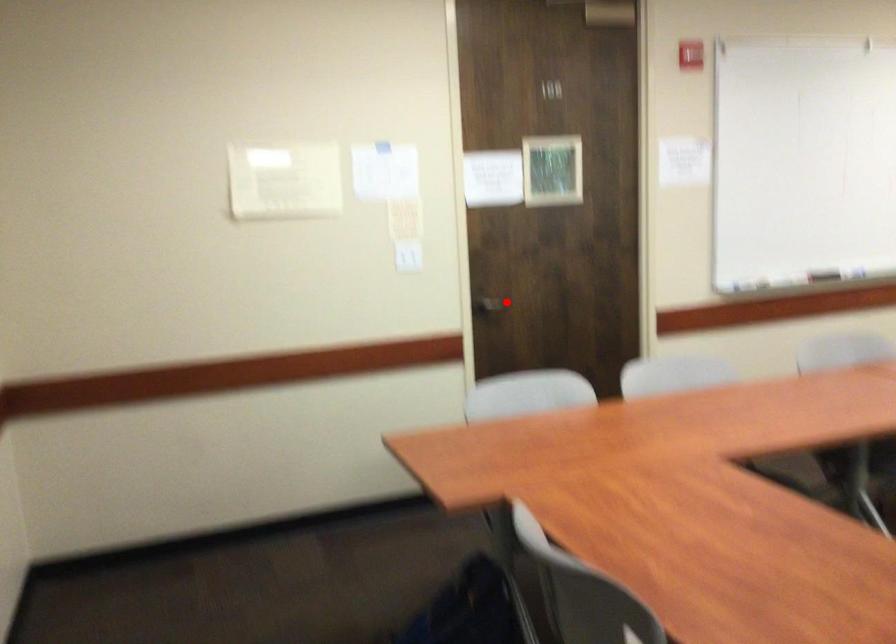
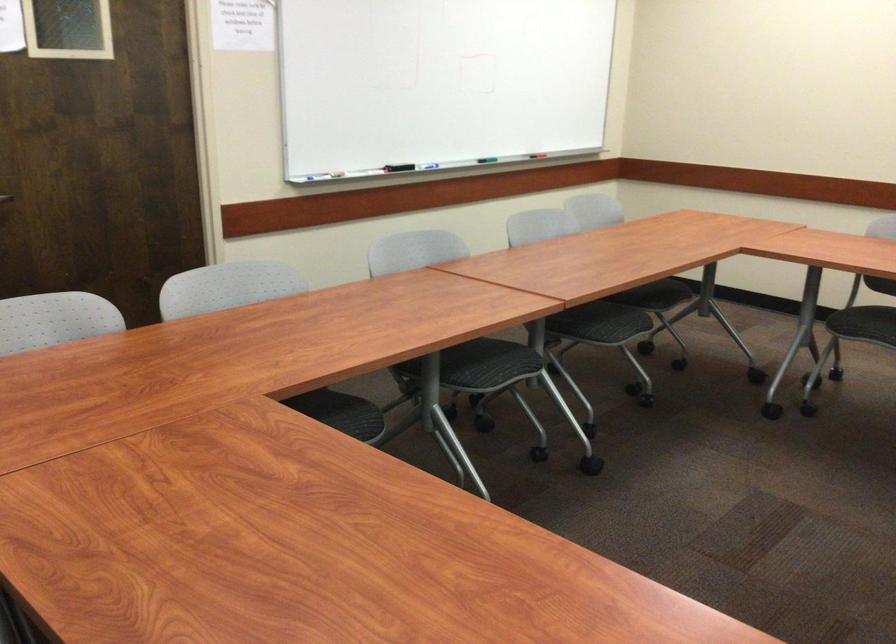
Question: I am providing you with two images of the same scene from different viewpoints. Image1 has a red point marked. In image2, the corresponding 3D location appears at what relative position? Reply with the corresponding letter.

Choices:
 (A) Closer
 (B) Farther

Answer: (A)